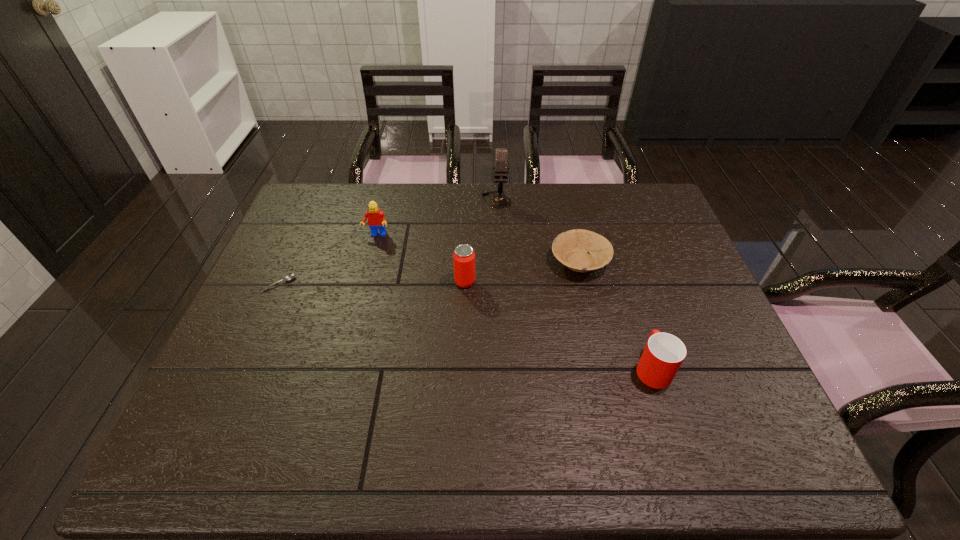
Where is `free space located 0.090m on the front-facing side of the second object from left to right`? The width and height of the screenshot is (960, 540). free space located 0.090m on the front-facing side of the second object from left to right is located at coordinates (371, 260).

Find the location of `vacant position located on the right of the third object from left to right`. vacant position located on the right of the third object from left to right is located at coordinates click(581, 282).

The image size is (960, 540). Find the location of `blank area located on the side of the nearest object with the handle`. blank area located on the side of the nearest object with the handle is located at coordinates (622, 275).

I want to click on vacant space located on the side of the nearest object with the handle, so tap(626, 288).

At what (x,y) coordinates should I click in order to perform the action: click on vacant space located on the side of the nearest object with the handle. Please return your answer as a coordinate pair (x, y). Image resolution: width=960 pixels, height=540 pixels. Looking at the image, I should click on (636, 316).

This screenshot has width=960, height=540. What are the coordinates of `vacant space located on the back of the second shortest object` in the screenshot? It's located at (564, 194).

This screenshot has height=540, width=960. Find the location of `free space located 0.170m on the front of the leftmost object`. free space located 0.170m on the front of the leftmost object is located at coordinates (252, 344).

This screenshot has height=540, width=960. Identify the location of object situated at the far edge. (499, 201).

You are a GUI agent. You are given a task and a screenshot of the screen. Output one action in this format:
    pyautogui.click(x=<x>, y=<y>)
    Task: Click on the object that is at the left edge
    Image resolution: width=960 pixels, height=540 pixels.
    Given the screenshot: What is the action you would take?
    pyautogui.click(x=291, y=276)

Locate an element on the screen. vacant region at the far edge of the desktop is located at coordinates (548, 220).